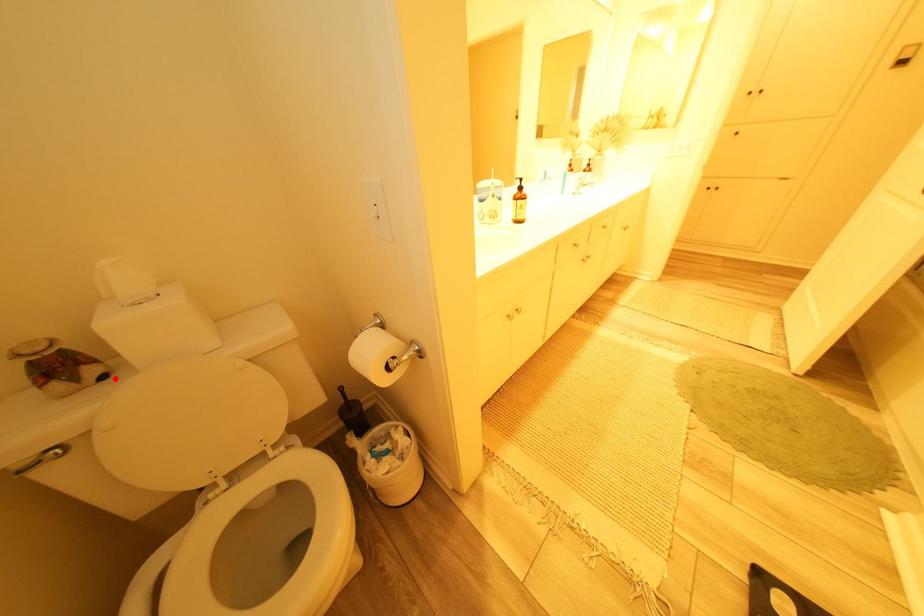
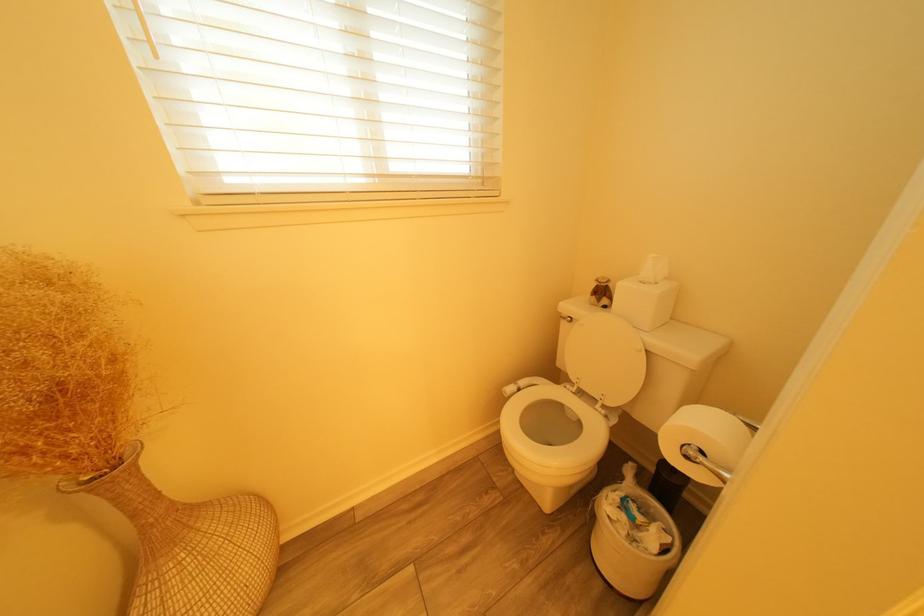
The point at the highlighted location is marked in the first image. Where is the corresponding point in the second image?

(615, 309)